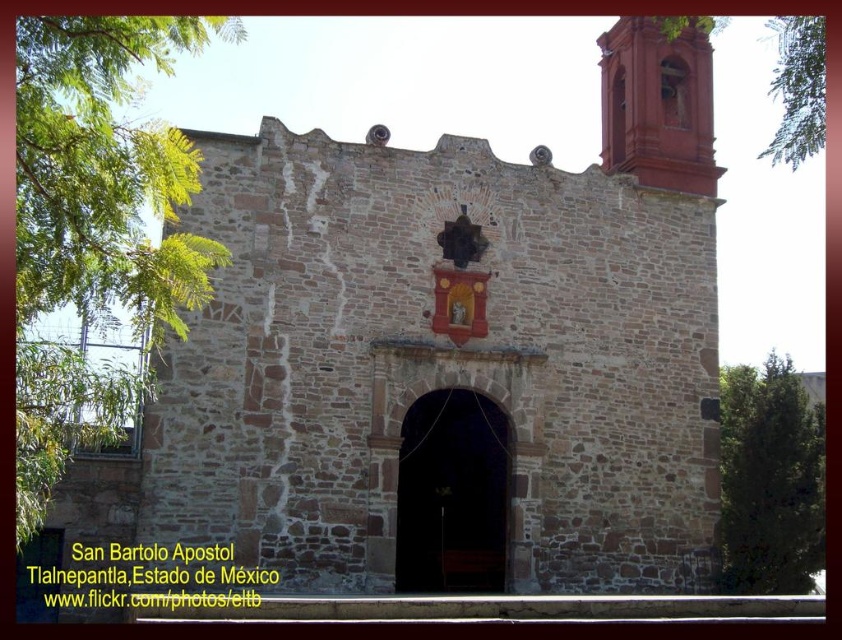
You are a tourist standing in front of the historic San Bartolo Apostol church. You notice the brown stone chapel at center and the smooth red bell tower at upper right. Which structure appears taller from your vantage point?

The brown stone chapel at center appears taller than the smooth red bell tower at upper right from your vantage point.

You are standing in front of the historic San Bartolo Apostol church and want to take a photo of the brown stone chapel at center and the smooth red bell tower at upper right. Which object should you focus on first if you want to capture both in a single frame without moving the camera?

You should focus on the brown stone chapel at center first because it is positioned on the left side of the smooth red bell tower at upper right, so keeping the chapel on the left allows both to be included in the frame.

You are a tourist standing in front of the historic church. You notice the brown stone chapel at center and the smooth red bell tower at upper right. Which structure is positioned closer to your viewpoint?

The brown stone chapel at center is closer to the viewer than the smooth red bell tower at upper right.